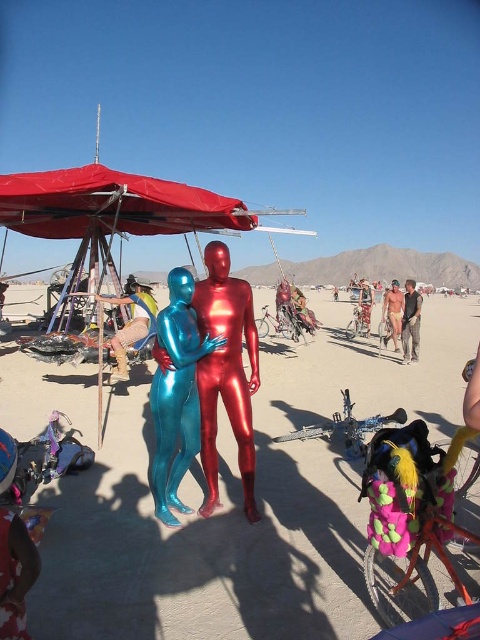
Question: Is metallic blue figure at center above brushed metal helmet at center?

Choices:
 (A) yes
 (B) no

Answer: (B)

Question: Which point appears farthest from the camera in this image?

Choices:
 (A) (405, 333)
 (B) (131, 292)

Answer: (A)

Question: Among these objects, which one is farthest from the camera?

Choices:
 (A) metallic red suit at center
 (B) metallic blue figure at center
 (C) metallic blue suit at lower left

Answer: (A)

Question: Is metallic blue figure at center positioned at the back of metallic red suit at center?

Choices:
 (A) yes
 (B) no

Answer: (B)

Question: Can you confirm if metallic red suit at center is positioned below tan skin human at center?

Choices:
 (A) yes
 (B) no

Answer: (A)

Question: Which of the following is the farthest from the observer?

Choices:
 (A) coord(180,374)
 (B) coord(31,205)
 (C) coord(117,301)
 (D) coord(223,321)

Answer: (B)